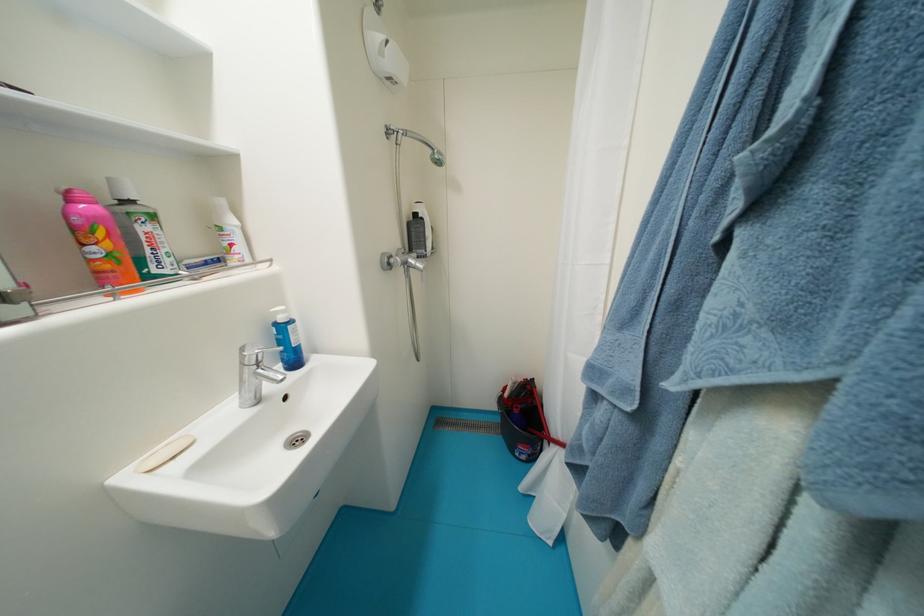
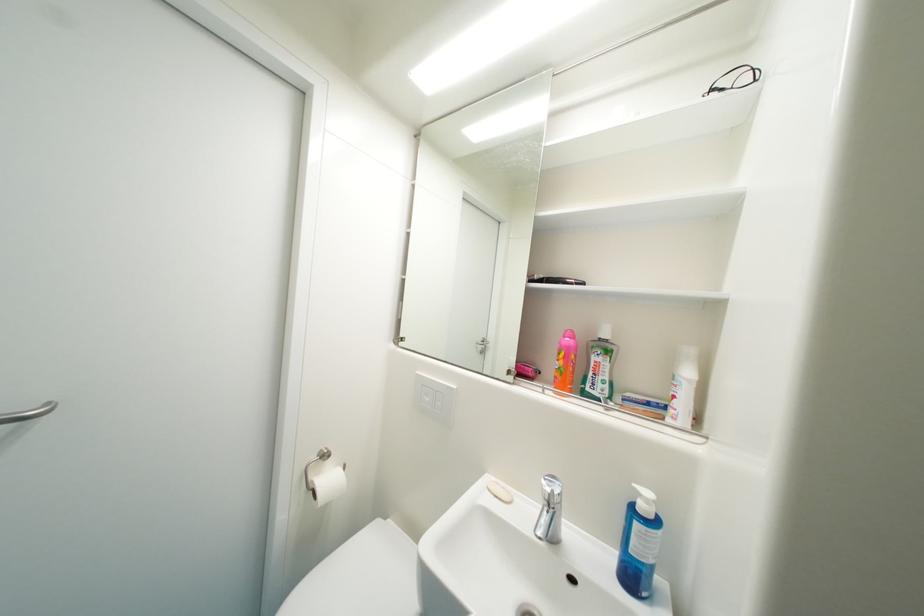
Where in the second image is the point corresponding to (x=124, y=256) from the first image?

(569, 371)